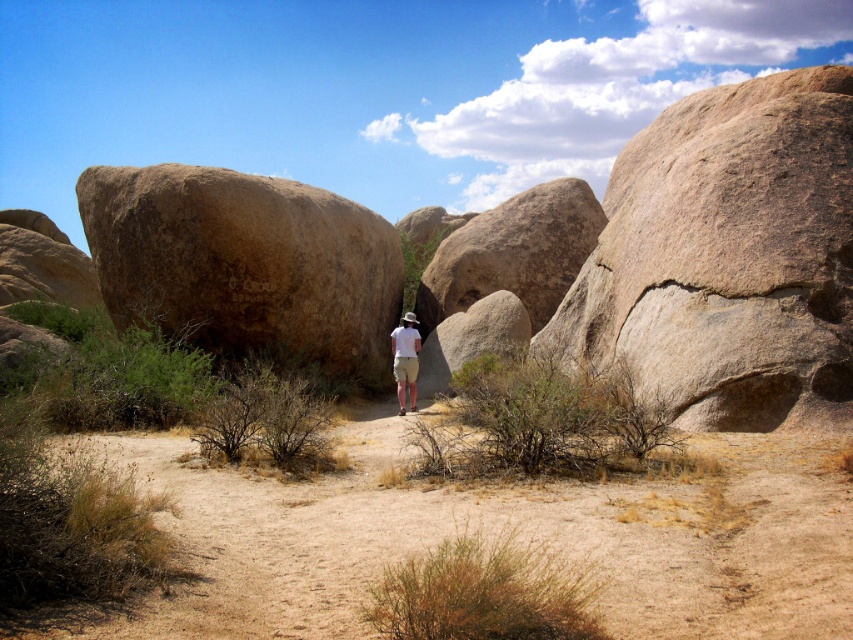
You are standing in the desert and see two points marked on the ground. The first point is at coordinate point (x=740, y=224) and the second is at point (x=107, y=193). Which point is closer to you?

Point (x=740, y=224) is closer to the viewer than point (x=107, y=193).